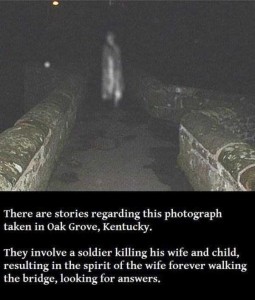
You are a GUI agent. You are given a task and a screenshot of the screen. Output one action in this format:
    pyautogui.click(x=<x>, y=<y>)
    Task: Click on the empty space to right of wall
    The height and width of the screenshot is (300, 255).
    Given the screenshot: What is the action you would take?
    pyautogui.click(x=249, y=138)